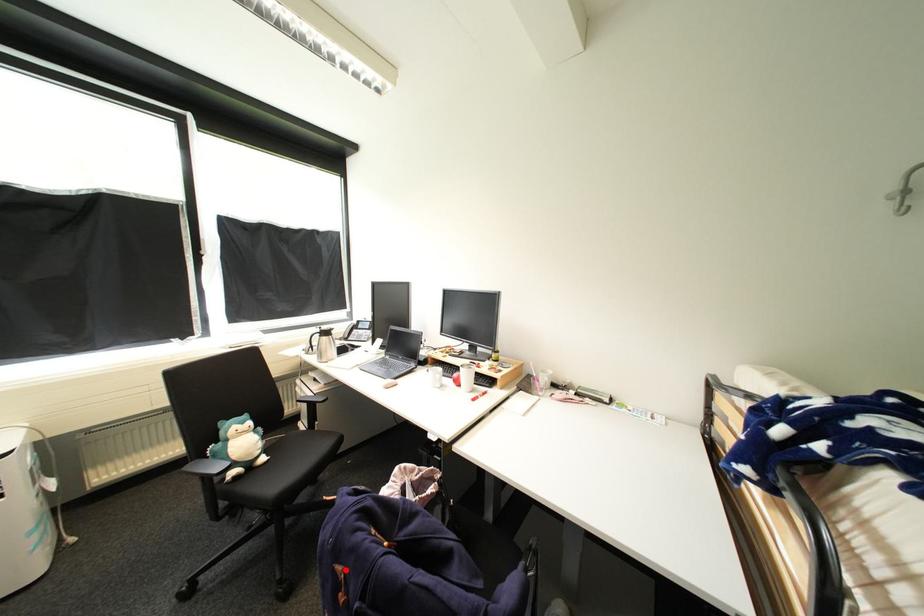
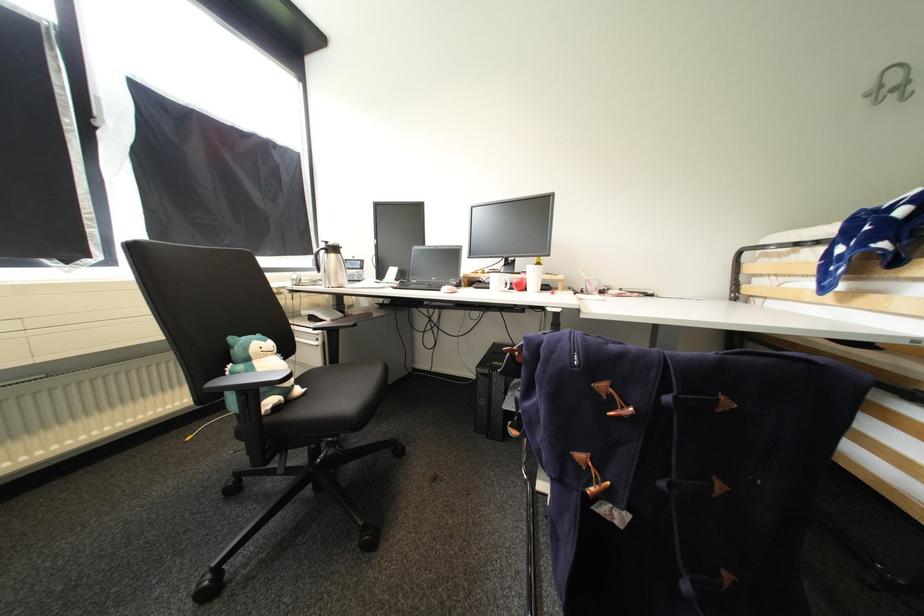
In the second image, find the point that corresponds to the highlighted location in the first image.

(610, 387)